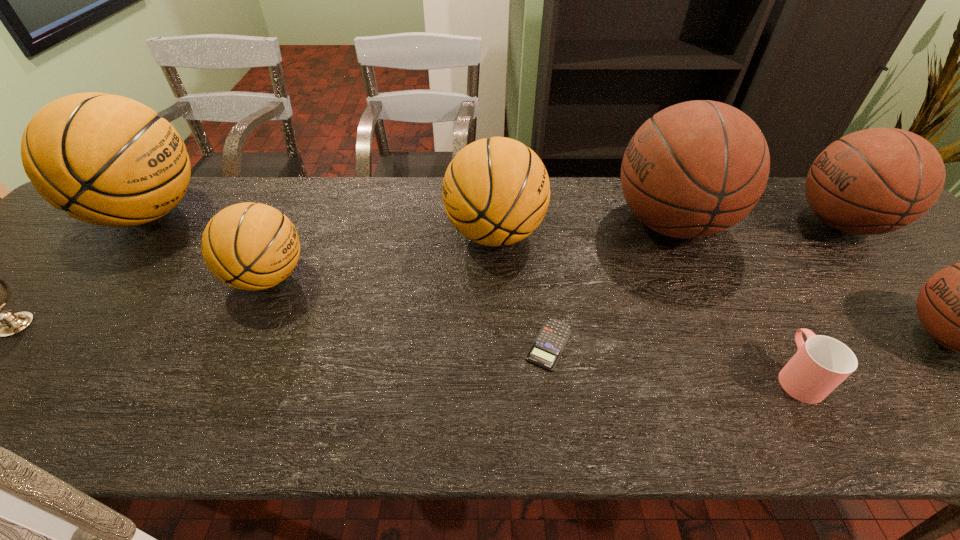
You are a GUI agent. You are given a task and a screenshot of the screen. Output one action in this format:
    pyautogui.click(x=<x>, y=<y>)
    Task: Click on the vacant space that satisfies the following two spatial constraints: 1. on the surface of the leftmost basketball near the brand logo; 2. on the side of the cup with the handle
    Image resolution: width=960 pixels, height=540 pixels.
    Given the screenshot: What is the action you would take?
    11,376

I want to click on free space that satisfies the following two spatial constraints: 1. on the side of the cup with the handle; 2. on the surface of the second orange basketball from right to left near the brand logo, so click(740, 277).

This screenshot has width=960, height=540. In order to click on free location that satisfies the following two spatial constraints: 1. on the side of the cup with the handle; 2. on the surface of the second biggest orange basketball near the brand logo in this screenshot , I will do `click(715, 234)`.

The width and height of the screenshot is (960, 540). Identify the location of vacant area in the image that satisfies the following two spatial constraints: 1. on the side of the eighth tallest object with the handle; 2. on the surface of the biggest orange basketball near the brand logo. (705, 214).